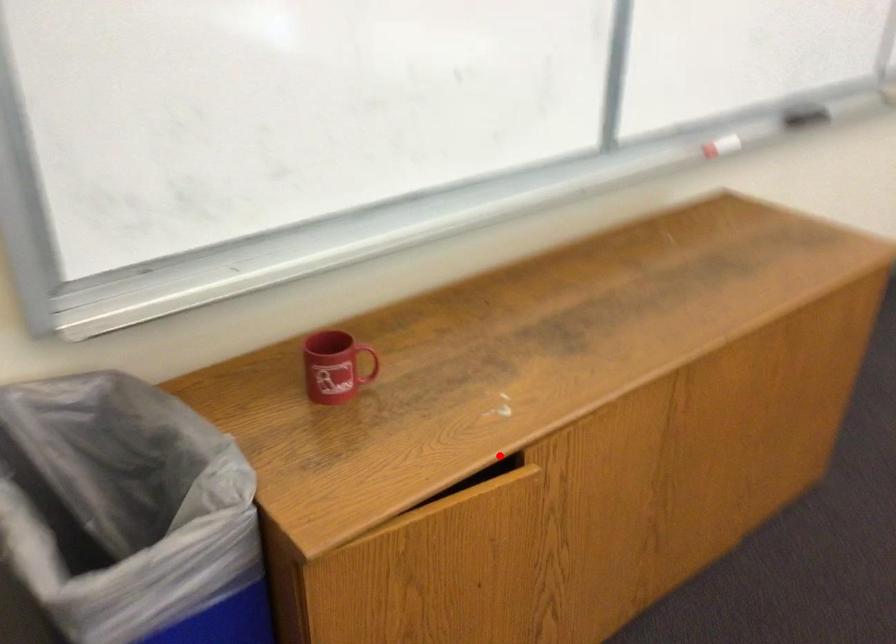
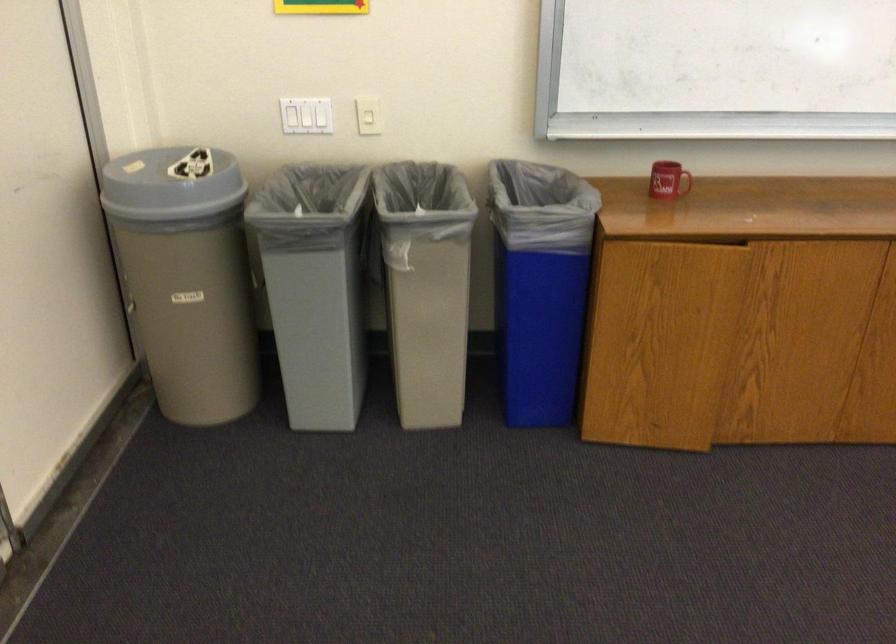
Question: I am providing you with two images of the same scene from different viewpoints. Given a red point in image1, look at the same physical point in image2. Is it:

Choices:
 (A) Closer to the viewpoint
 (B) Farther from the viewpoint

Answer: (B)